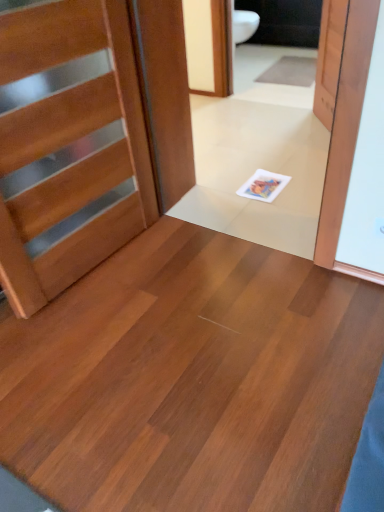
Question: Is matte wood floor at center inside or outside of wooden door at left, placed as the first door when sorted from front to back?

Choices:
 (A) outside
 (B) inside

Answer: (A)

Question: From the image's perspective, relative to wooden door at left, marked as the 1th door in a left-to-right arrangement, is matte wood floor at center above or below?

Choices:
 (A) above
 (B) below

Answer: (B)

Question: Estimate the real-world distances between objects in this image. Which object is closer to the wooden door at left, marked as the second door in a back-to-front arrangement?

Choices:
 (A) gray carpet at upper center
 (B) matte wood floor at center
 (C) wooden door at upper right, which is the 1th door in right-to-left order

Answer: (B)

Question: Estimate the real-world distances between objects in this image. Which object is farther from the gray carpet at upper center?

Choices:
 (A) wooden door at left, which is counted as the 2th door, starting from the right
 (B) wooden door at upper right, which is the 1th door in right-to-left order
 (C) matte wood floor at center

Answer: (C)